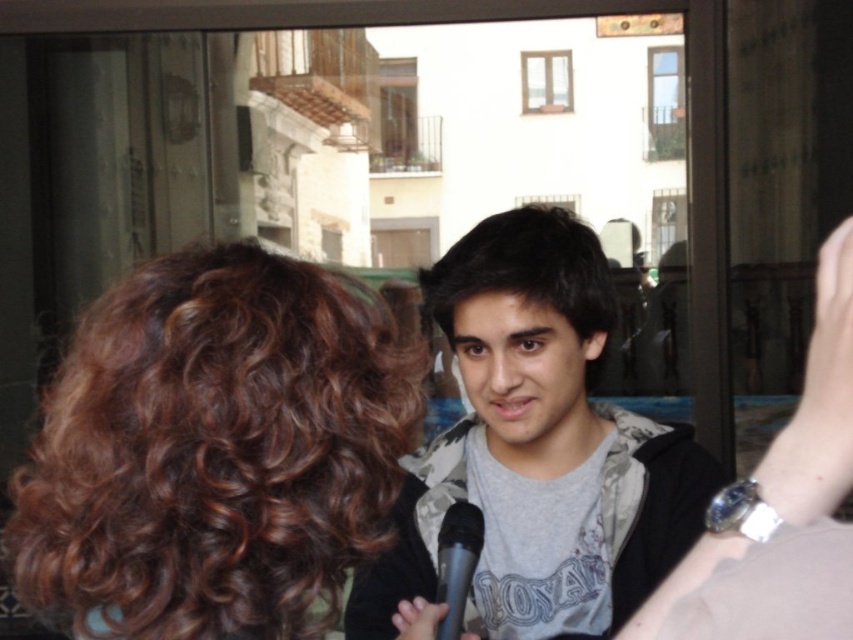
Question: Which object is closer to the camera taking this photo?

Choices:
 (A) dark brown hair at center
 (B) gray cotton shirt at center
 (C) curly hair at center

Answer: (C)

Question: Estimate the real-world distances between objects in this image. Which object is farther from the curly hair at center?

Choices:
 (A) dark brown hair at center
 (B) gray cotton shirt at center

Answer: (A)

Question: Which point is farther from the camera taking this photo?

Choices:
 (A) (599, 272)
 (B) (508, 278)
 (C) (413, 394)

Answer: (A)

Question: Is gray cotton shirt at center wider than dark brown hair at center?

Choices:
 (A) no
 (B) yes

Answer: (B)

Question: From the image, what is the correct spatial relationship of curly hair at center in relation to dark brown hair at center?

Choices:
 (A) right
 (B) left

Answer: (B)

Question: Does curly hair at center lie in front of gray cotton shirt at center?

Choices:
 (A) no
 (B) yes

Answer: (B)